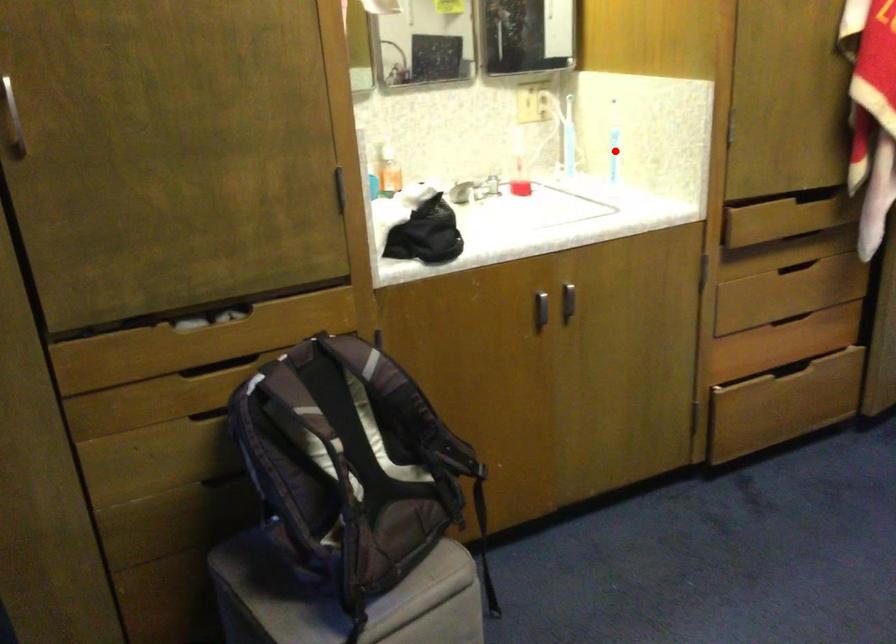
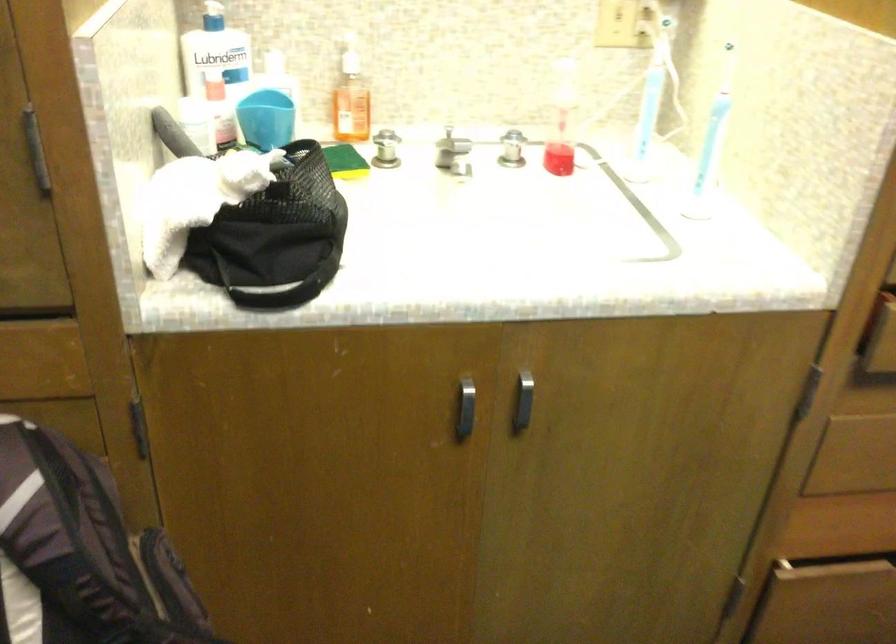
Where in the second image is the point corresponding to the highlighted location from the first image?

(711, 144)